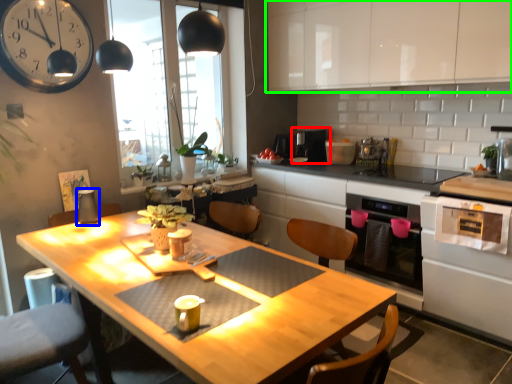
Question: Which object is positioned closest to appliance (highlighted by a red box)? Select from appliance (highlighted by a blue box) and cabinetry (highlighted by a green box).

Choices:
 (A) appliance
 (B) cabinetry

Answer: (B)